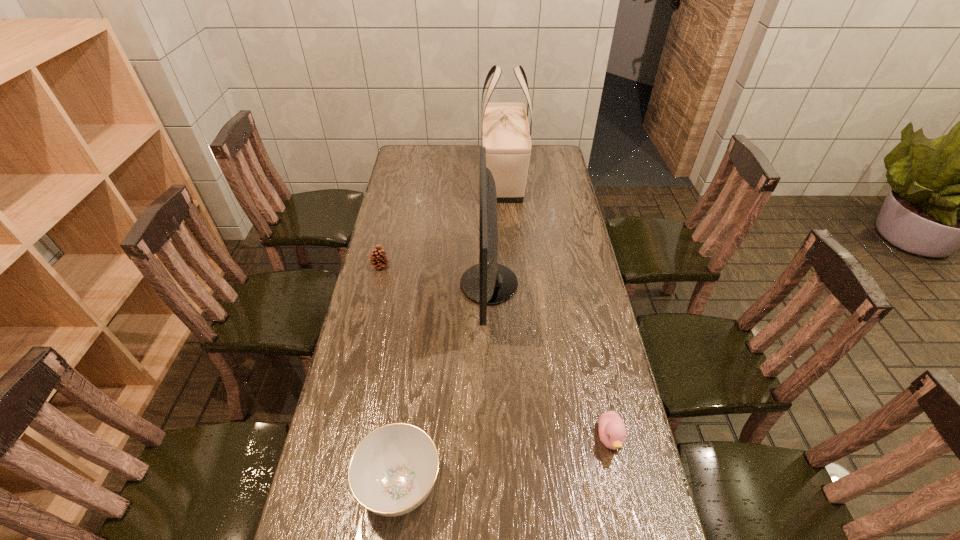
Identify which object is located as the second nearest to the duckling. Please provide its 2D coordinates. Your answer should be formatted as a tuple, i.e. [(x, y)], where the tuple contains the x and y coordinates of a point satisfying the conditions above.

[(392, 471)]

Locate which object ranks in proximity to the rightmost object. Please provide its 2D coordinates. Your answer should be formatted as a tuple, i.e. [(x, y)], where the tuple contains the x and y coordinates of a point satisfying the conditions above.

[(488, 283)]

What are the coordinates of `vacant area in the image that satisfies the following two spatial constraints: 1. on the screen side of the second tallest object; 2. on the front side of the fourth object from right to left` in the screenshot? It's located at (493, 484).

Where is `free point that satisfies the following two spatial constraints: 1. with handles facing forward on the tallest object; 2. on the screen side of the monitor`? This screenshot has width=960, height=540. free point that satisfies the following two spatial constraints: 1. with handles facing forward on the tallest object; 2. on the screen side of the monitor is located at coordinates (511, 285).